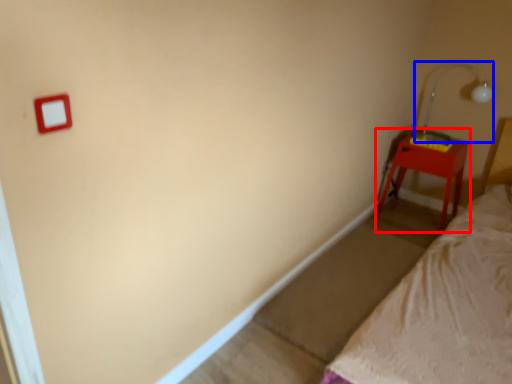
Question: Which of the following is the farthest to the observer, nightstand (highlighted by a red box) or lamp (highlighted by a blue box)?

Choices:
 (A) nightstand
 (B) lamp

Answer: (A)